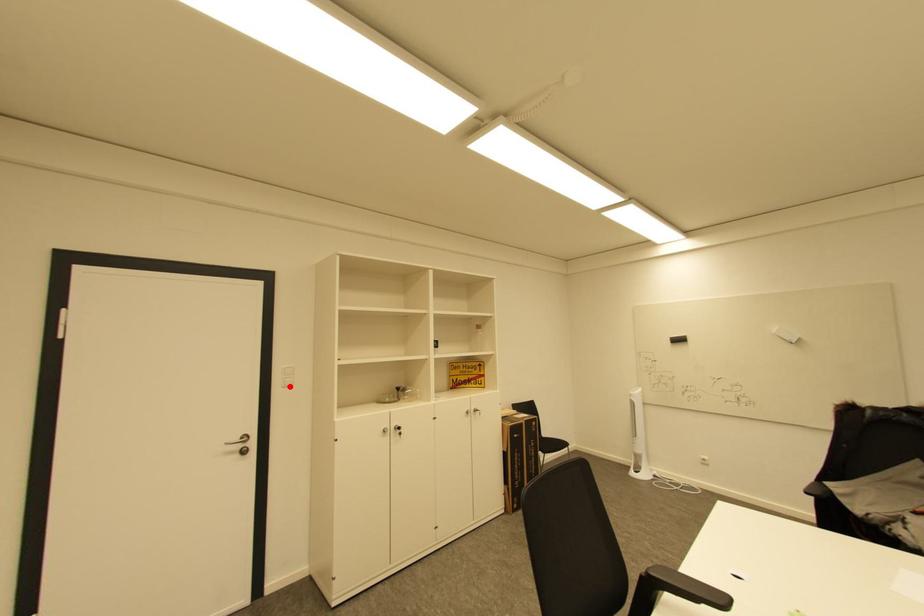
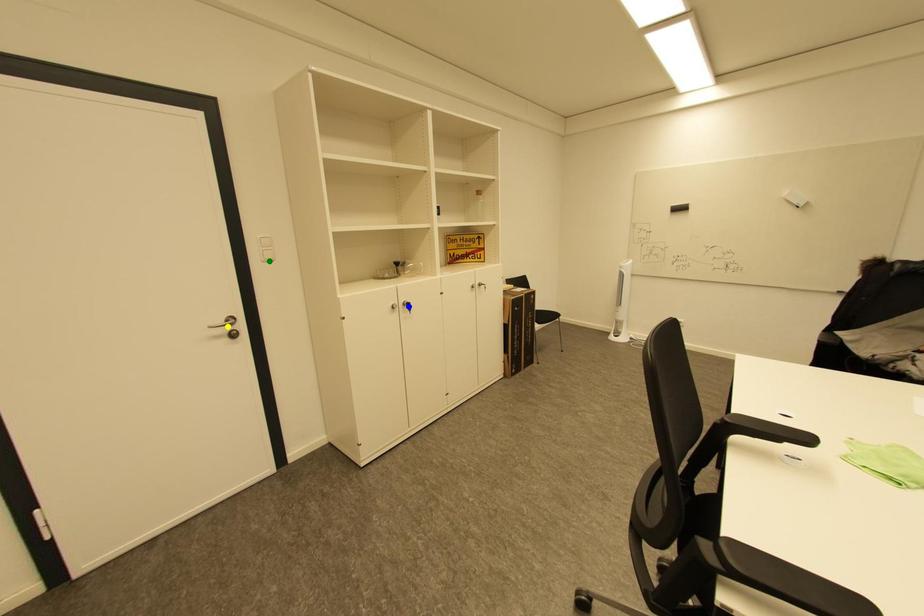
Question: I am providing you with two images of the same scene from different viewpoints. A red point is marked on the first image. You are given multiple points on the second image. Which mark in image 2 goes with the point in image 1?

Choices:
 (A) yellow point
 (B) blue point
 (C) green point

Answer: (C)